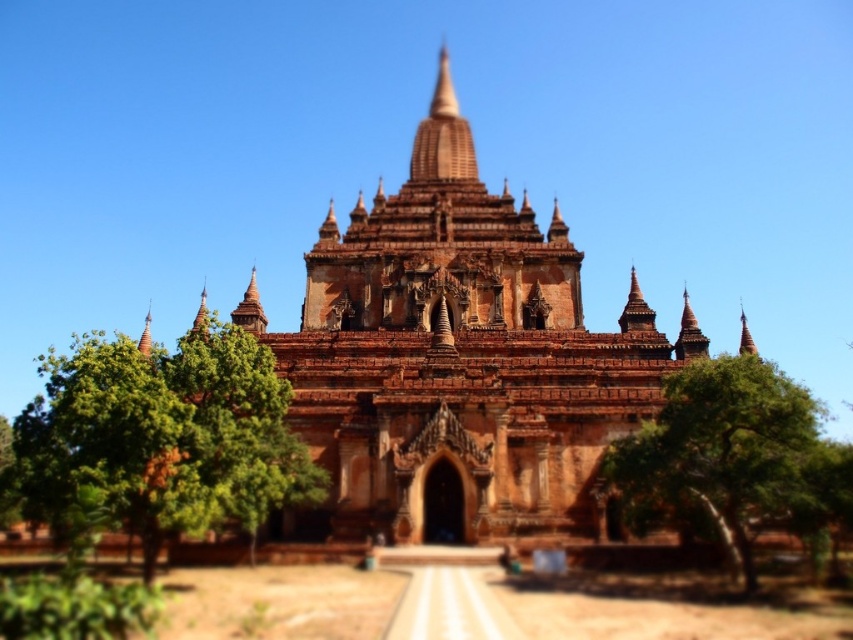
Between brown textured pagoda at center and brown stone temple at center, which one appears on the right side from the viewer's perspective?

brown textured pagoda at center is more to the right.

From the picture: Is the position of brown textured pagoda at center less distant than that of brown stone temple at center?

Yes.

The height and width of the screenshot is (640, 853). What do you see at coordinates (457, 362) in the screenshot?
I see `brown textured pagoda at center` at bounding box center [457, 362].

Identify the location of brown textured pagoda at center. (457, 362).

Is point (158, 396) farther from camera compared to point (750, 541)?

That is False.

Find the location of a particular element. Image resolution: width=853 pixels, height=640 pixels. green leafy tree at left is located at coordinates tap(160, 440).

Is green leafy tree at left thinner than brown stone temple at center?

No.

I want to click on green leafy tree at left, so click(160, 440).